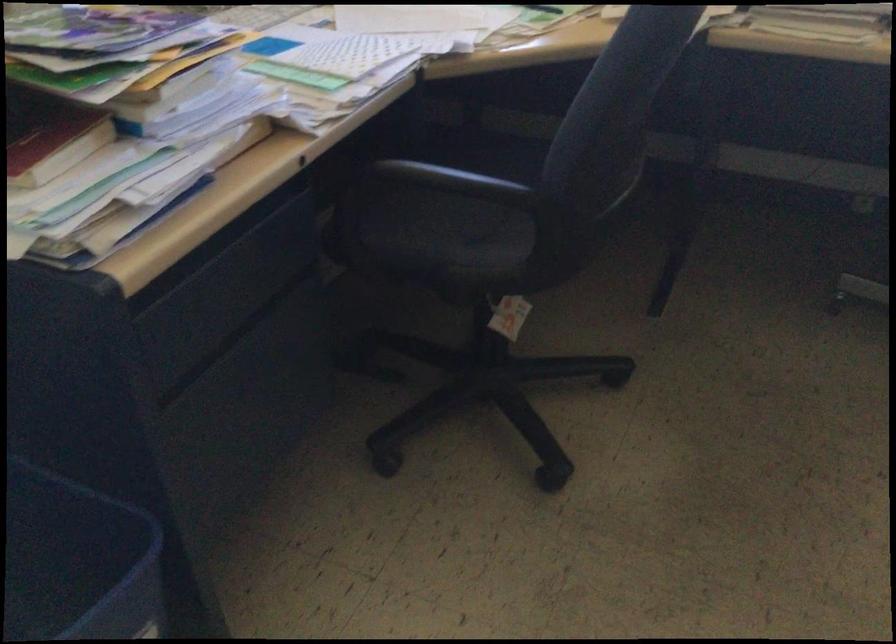
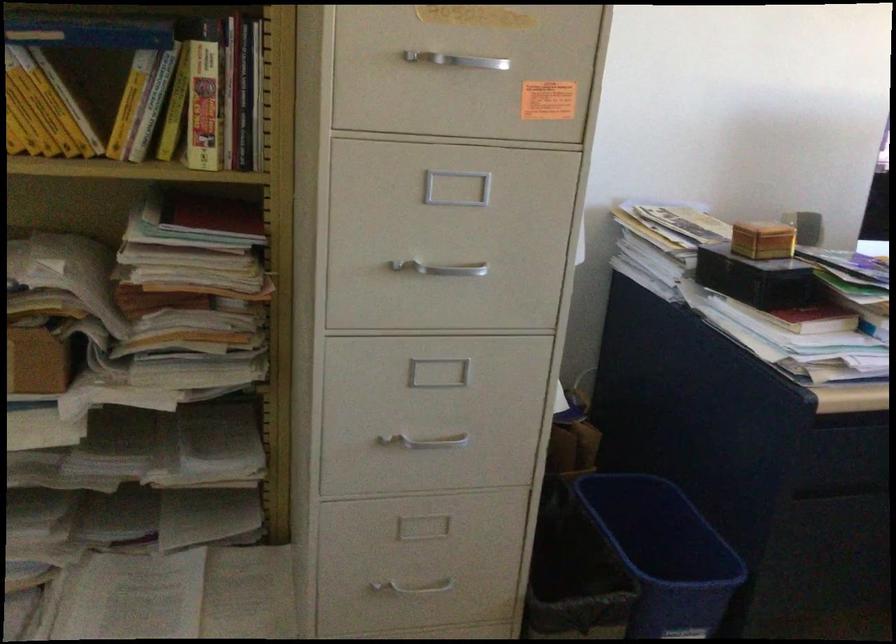
Question: The camera is either moving clockwise (left) or counter-clockwise (right) around the object. The first image is from the beginning of the video and the second image is from the end. Is the camera moving left or right when shooting the video?

Choices:
 (A) Left
 (B) Right

Answer: (B)